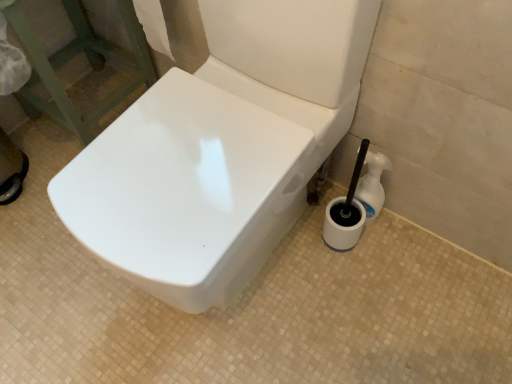
Question: Based on their sizes in the image, would you say white paper at upper left is bigger or smaller than white plastic bottle at lower right?

Choices:
 (A) small
 (B) big

Answer: (B)

Question: From a real-world perspective, is white paper at upper left above or below white plastic bottle at lower right?

Choices:
 (A) above
 (B) below

Answer: (A)

Question: Considering the positions of white paper at upper left and white plastic bottle at lower right in the image, is white paper at upper left taller or shorter than white plastic bottle at lower right?

Choices:
 (A) tall
 (B) short

Answer: (A)

Question: From a real-world perspective, is white plastic bottle at lower right physically located above or below white paper at upper left?

Choices:
 (A) below
 (B) above

Answer: (A)

Question: Based on their sizes in the image, would you say white plastic bottle at lower right is bigger or smaller than white paper at upper left?

Choices:
 (A) big
 (B) small

Answer: (B)

Question: Would you say white plastic bottle at lower right is to the left or to the right of white paper at upper left in the picture?

Choices:
 (A) right
 (B) left

Answer: (A)

Question: Is point (371, 190) closer or farther from the camera than point (152, 29)?

Choices:
 (A) farther
 (B) closer

Answer: (B)